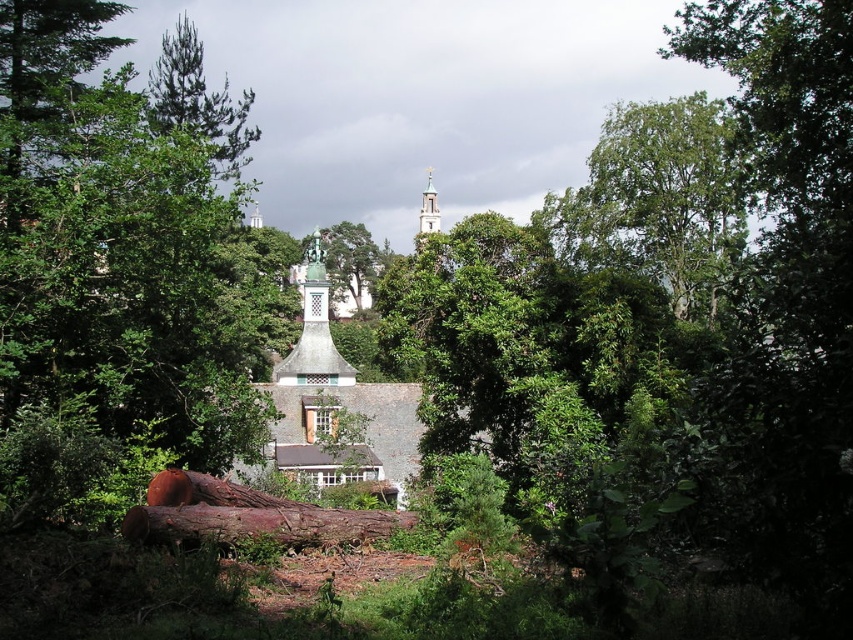
Question: Which is nearer to the brown rough wood log at lower center?

Choices:
 (A) green stone tower at upper center
 (B) green leafy tree at lower left

Answer: (B)

Question: Among these points, which one is nearest to the camera?

Choices:
 (A) (422, 204)
 (B) (253, 529)
 (C) (132, 381)

Answer: (B)

Question: Is green needle-like at upper left bigger than green stone tower at upper center?

Choices:
 (A) no
 (B) yes

Answer: (B)

Question: Can you confirm if brown rough wood log at lower center is smaller than green stone tower at upper center?

Choices:
 (A) yes
 (B) no

Answer: (A)

Question: Is green leafy tree at lower left smaller than brown rough wood log at lower center?

Choices:
 (A) no
 (B) yes

Answer: (A)

Question: Which point is closer to the camera taking this photo?

Choices:
 (A) (199, 86)
 (B) (433, 193)

Answer: (A)